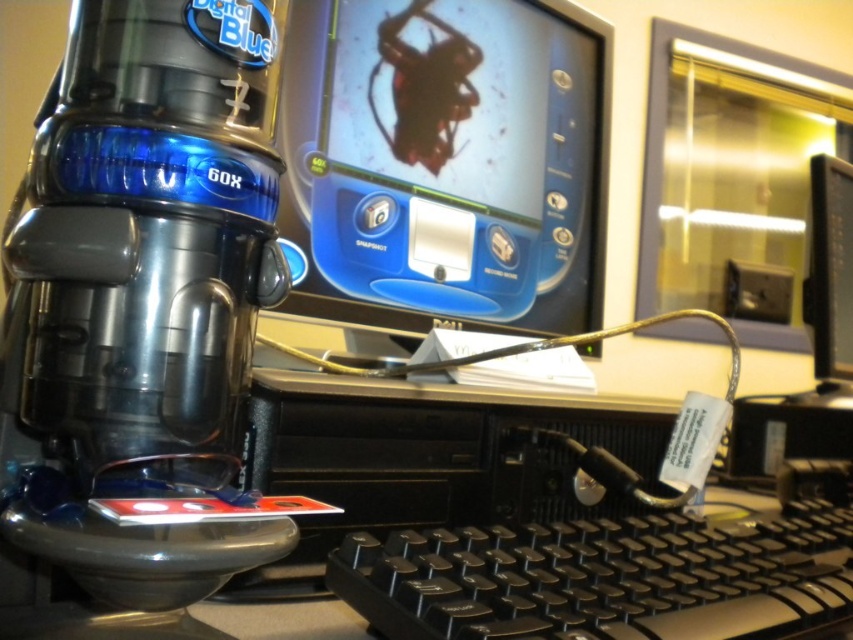
You are setting up a home office and need to place a new lamp between the matte plastic monitor at center and the black plastic keyboard at center. Based on their positions, where should the lamp be placed?

The lamp should be placed between the matte plastic monitor at center and the black plastic keyboard at center. Since the matte plastic monitor at center is above the black plastic keyboard at center, the lamp can be positioned either above the keyboard or below the monitor to ensure it provides adequate lighting to both devices.

Consider the image. You are setting up a dual monitor workstation. You have a matte plastic monitor at center and a black glossy monitor at upper center. Which one can you place on the larger desk space if you need to prioritize size?

The matte plastic monitor at center has a larger size compared to the black glossy monitor at upper center, so it should be placed on the larger desk space to accommodate its size.

You need to place a 12 inch ruler between the matte plastic monitor at center and the camera. Will the ruler fit exactly between them without overlapping either device?

The distance between the matte plastic monitor at center and the camera is 24.46 inches. Since the ruler is 12 inches long, it will fit exactly between them without overlapping either device because 12 inches is exactly half of 24.46 inches.